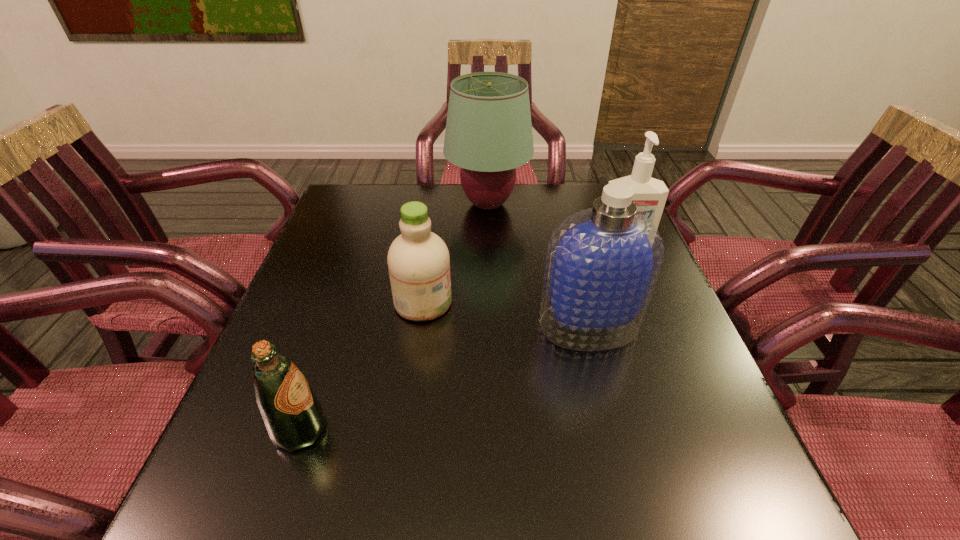
The height and width of the screenshot is (540, 960). Find the location of `object situated at the left edge`. object situated at the left edge is located at coordinates (293, 416).

In the image, there is a desktop. At what (x,y) coordinates should I click in order to perform the action: click on vacant space at the far edge. Please return your answer as a coordinate pair (x, y). This screenshot has height=540, width=960. Looking at the image, I should click on (409, 191).

The image size is (960, 540). What are the coordinates of `blank space at the near edge of the desktop` in the screenshot? It's located at (305, 506).

The image size is (960, 540). In order to click on vacant space at the left edge in this screenshot , I will do (263, 446).

In the image, there is a desktop. Identify the location of free region at the right edge. The height and width of the screenshot is (540, 960). (696, 395).

Image resolution: width=960 pixels, height=540 pixels. I want to click on vacant area at the near left corner of the desktop, so click(217, 476).

The width and height of the screenshot is (960, 540). I want to click on blank area at the far right corner, so (x=588, y=205).

The width and height of the screenshot is (960, 540). In order to click on free space at the near right corner of the desktop in this screenshot , I will do `click(777, 524)`.

Find the location of `vacant region between the leftmost cleansing agent and the farthest cleansing agent`. vacant region between the leftmost cleansing agent and the farthest cleansing agent is located at coordinates (523, 275).

At what (x,y) coordinates should I click in order to perform the action: click on free space between the farthest object and the second farthest object. Please return your answer as a coordinate pair (x, y). The width and height of the screenshot is (960, 540). Looking at the image, I should click on (555, 227).